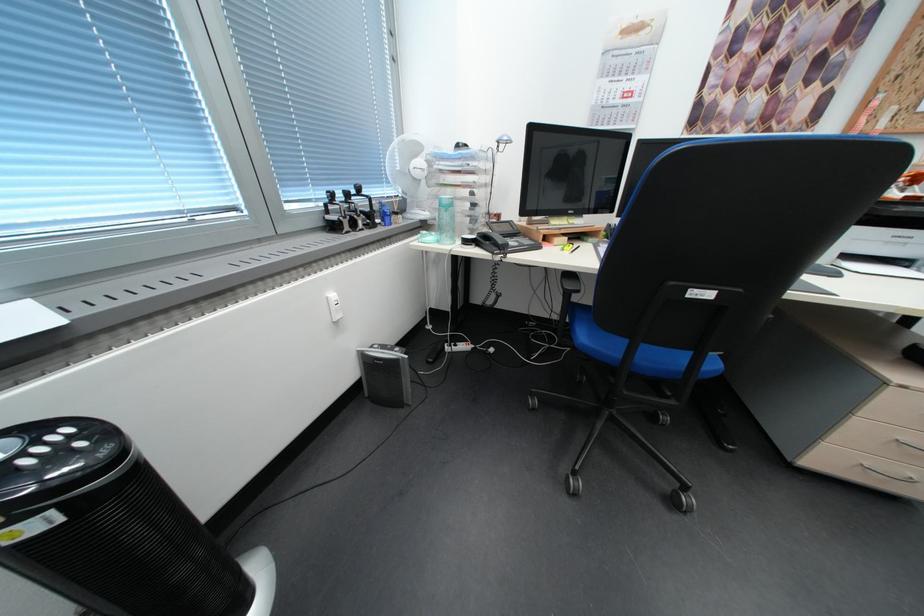
What are the coordinates of `telephone handset` in the screenshot? It's located at (496, 241).